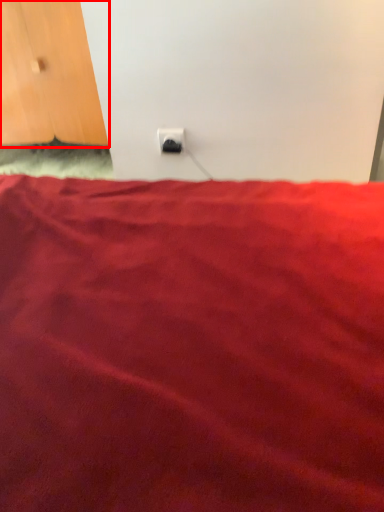
Question: From the image, what is the correct spatial relationship of door (annotated by the red box) in relation to power plugs and sockets?

Choices:
 (A) left
 (B) right

Answer: (A)